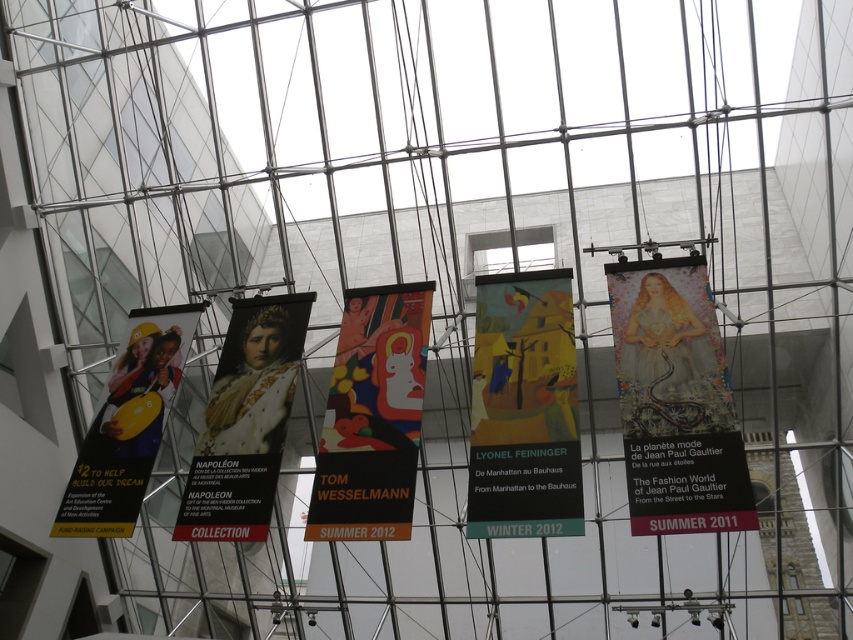
Question: Can you confirm if matte gold banner at center is positioned above matte yellow banner at center?

Choices:
 (A) yes
 (B) no

Answer: (A)

Question: Which point is closer to the camera taking this photo?

Choices:
 (A) (250, 364)
 (B) (532, 282)

Answer: (B)

Question: Does matte gold banner at center appear under matte yellow banner at center?

Choices:
 (A) yes
 (B) no

Answer: (B)

Question: Which object is farther from the camera taking this photo?

Choices:
 (A) matte gold portrait at center
 (B) matte yellow banner at center

Answer: (A)

Question: Which point appears closest to the camera in this image?

Choices:
 (A) (685, 310)
 (B) (253, 339)
 (C) (428, 282)

Answer: (A)

Question: Where is matte gold banner at center located in relation to matte yellow construction helmet at left in the image?

Choices:
 (A) above
 (B) below

Answer: (A)